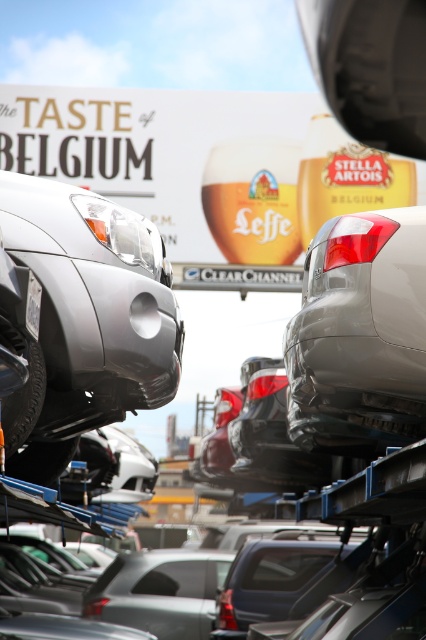
Does satin silver car at left appear under white plastic license plate at center?

Correct, satin silver car at left is located below white plastic license plate at center.

Who is taller, satin silver car at left or white plastic license plate at center?

satin silver car at left is taller.

Image resolution: width=426 pixels, height=640 pixels. What do you see at coordinates (89, 310) in the screenshot?
I see `satin silver car at left` at bounding box center [89, 310].

You are a GUI agent. You are given a task and a screenshot of the screen. Output one action in this format:
    pyautogui.click(x=<x>, y=<y>)
    Task: Click on the satin silver car at left
    This screenshot has height=640, width=426.
    Given the screenshot: What is the action you would take?
    pyautogui.click(x=89, y=310)

Does satin silver car at upper right have a greater height compared to white plastic license plate at center?

Yes, satin silver car at upper right is taller than white plastic license plate at center.

Between point (313, 385) and point (37, 326), which one is positioned in front?

Point (37, 326) is more forward.

Which is behind, point (350, 225) or point (29, 280)?

The point (350, 225) is more distant.

What are the coordinates of `satin silver car at upper right` in the screenshot? It's located at (359, 336).

Is satin silver car at left above satin silver car at upper right?

Indeed, satin silver car at left is positioned over satin silver car at upper right.

Does point (88, 364) come closer to viewer compared to point (347, 253)?

No, it is not.

Where is `satin silver car at left`? This screenshot has height=640, width=426. satin silver car at left is located at coordinates (89, 310).